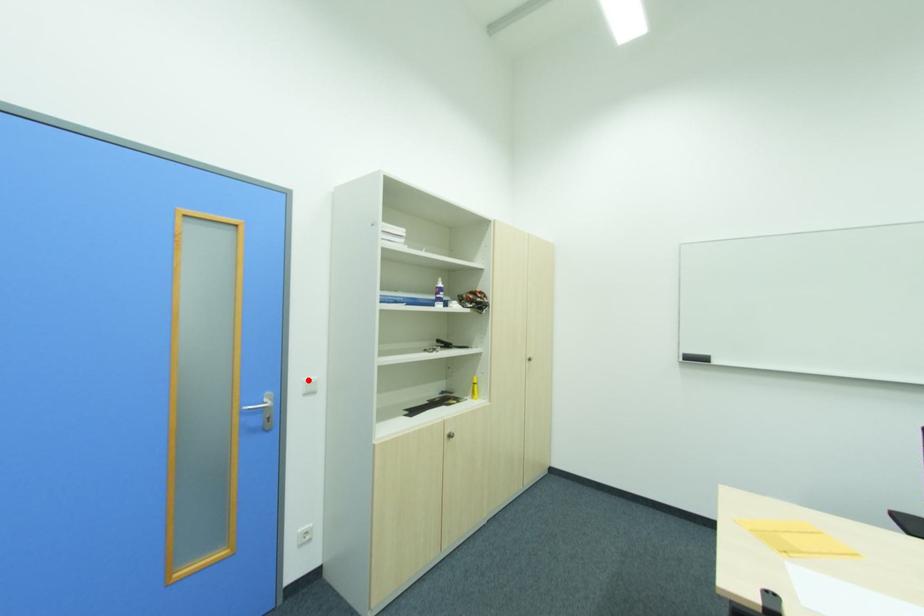
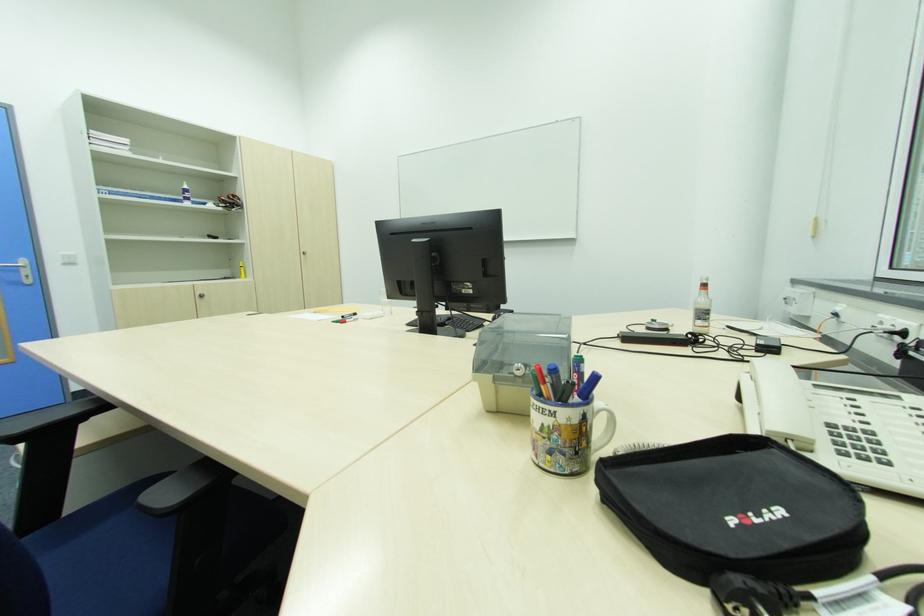
Locate, in the second image, the point that corresponds to the highlighted location in the first image.

(64, 254)